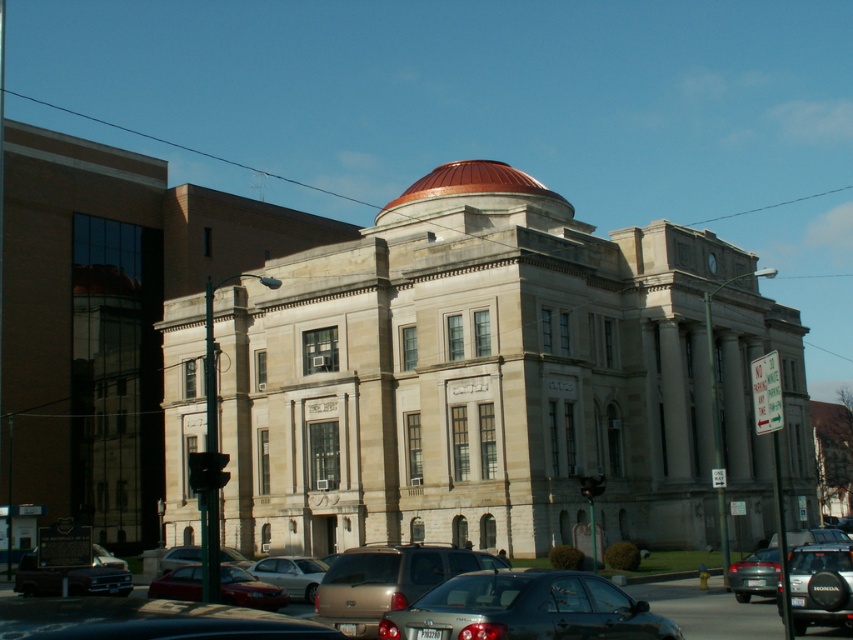
You are driving a 4.5 meter long truck and want to park your vehicle between the shiny black sedan at lower left and the metallic silver sedan at center. Based on the scene, can your truck fit in the space between them?

The distance between the shiny black sedan at lower left and the metallic silver sedan at center is 4.63 meters, which is slightly longer than the truck length of 4.5 meters. Therefore, the truck can fit between them with a small amount of space to spare.

You are a delivery driver who needs to park your truck, which is 2 meters wide, in this area. There are two vehicles in the way currently, a gold metallic suv at center and a silver metallic sedan at center. Which vehicle, if any, do you think you can pass around to make space for your truck?

The gold metallic suv at center might be wider than the silver metallic sedan at center, so the silver metallic sedan at center is narrower and easier to move out of the way to create space for the 2 meter wide truck.